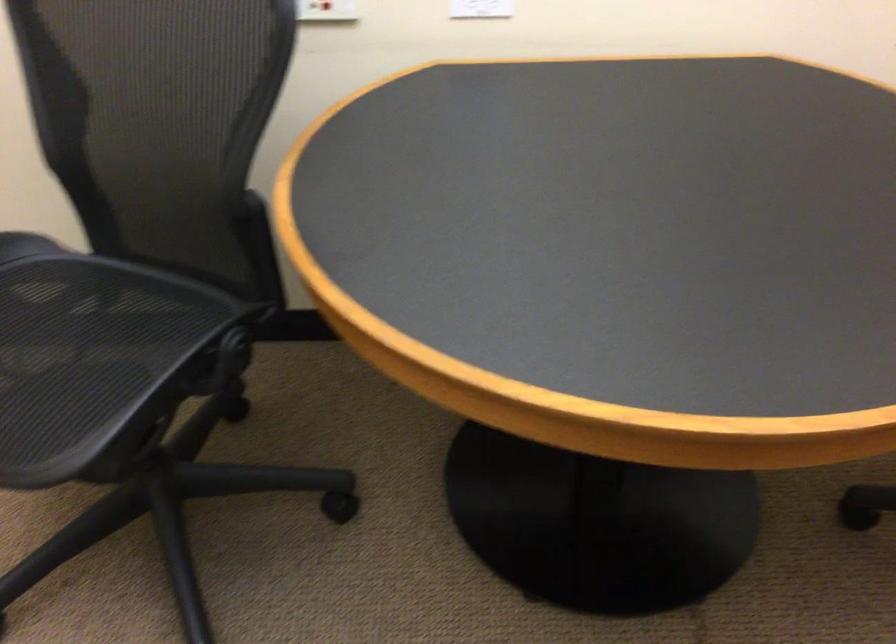
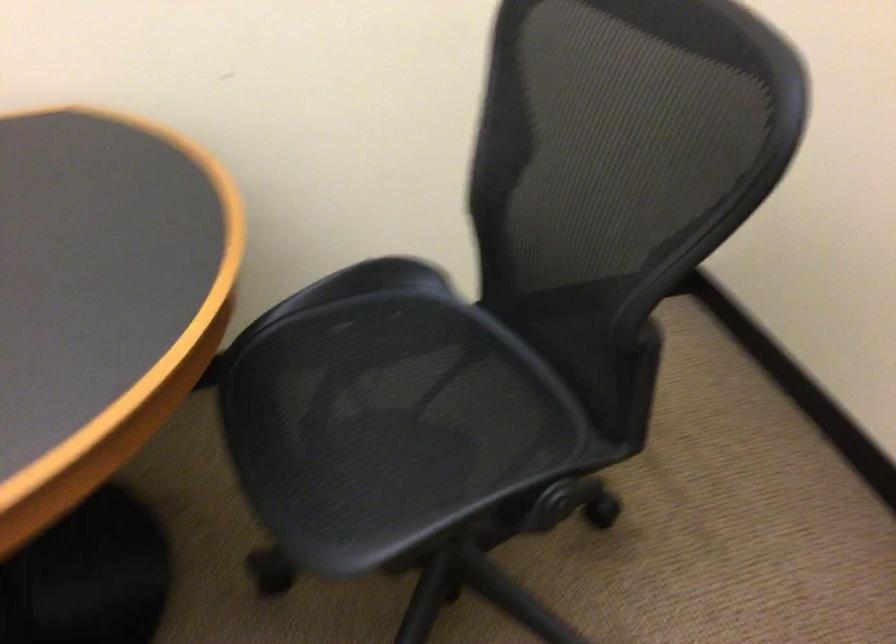
Question: The camera is either moving clockwise (left) or counter-clockwise (right) around the object. The first image is from the beginning of the video and the second image is from the end. Is the camera moving left or right when shooting the video?

Choices:
 (A) Left
 (B) Right

Answer: (A)